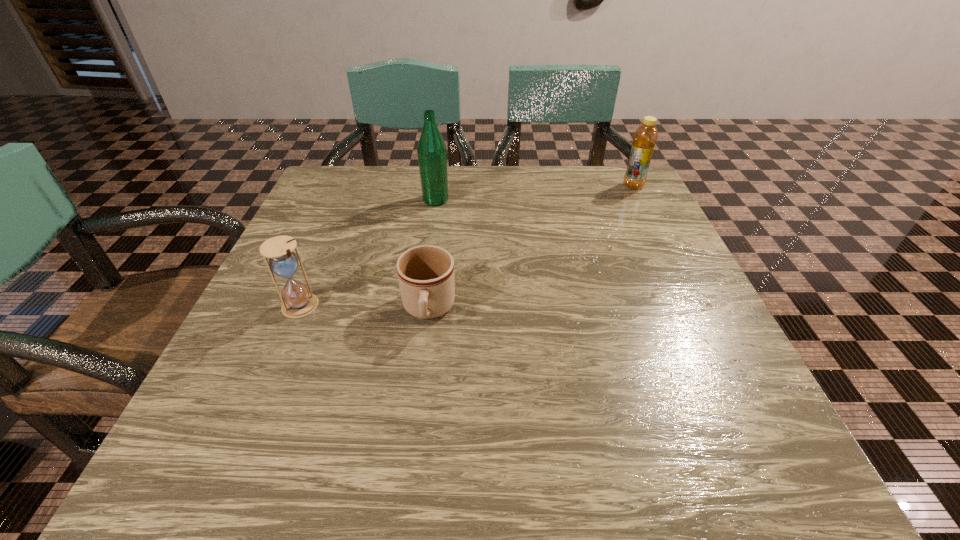
The height and width of the screenshot is (540, 960). What are the coordinates of `object that is positioned at the left edge` in the screenshot? It's located at (297, 302).

Where is `object located in the right edge section of the desktop`? The width and height of the screenshot is (960, 540). object located in the right edge section of the desktop is located at coordinates (645, 137).

Find the location of a particular element. The image size is (960, 540). object that is at the far right corner is located at coordinates (645, 137).

Identify the location of vacant space at the far edge. Image resolution: width=960 pixels, height=540 pixels. (516, 173).

This screenshot has height=540, width=960. Identify the location of vacant region at the near edge of the desktop. (362, 456).

Identify the location of vacant area at the left edge of the desktop. The image size is (960, 540). (249, 370).

In the image, there is a desktop. Where is `vacant area at the right edge`? The height and width of the screenshot is (540, 960). vacant area at the right edge is located at coordinates (615, 266).

Locate an element on the screen. The height and width of the screenshot is (540, 960). vacant region at the far left corner of the desktop is located at coordinates (314, 198).

Find the location of a particular element. This screenshot has width=960, height=540. vacant space at the far right corner is located at coordinates (652, 212).

Find the location of `free space between the shorter bottle and the hourglass`. free space between the shorter bottle and the hourglass is located at coordinates (467, 246).